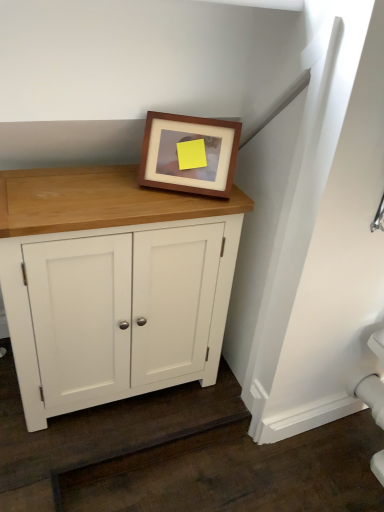
Question: Considering their positions, is brown wooden picture frame at upper center located in front of or behind white wood cupboard at center?

Choices:
 (A) behind
 (B) front

Answer: (A)

Question: Is brown wooden picture frame at upper center wider or thinner than white wood cupboard at center?

Choices:
 (A) wide
 (B) thin

Answer: (B)

Question: In the image, is brown wooden picture frame at upper center on the left side or the right side of white wood cupboard at center?

Choices:
 (A) left
 (B) right

Answer: (B)

Question: Considering the positions of point (67, 236) and point (157, 115), is point (67, 236) closer or farther from the camera than point (157, 115)?

Choices:
 (A) farther
 (B) closer

Answer: (B)

Question: In terms of size, does white wood cupboard at center appear bigger or smaller than brown wooden picture frame at upper center?

Choices:
 (A) big
 (B) small

Answer: (A)

Question: Do you think white wood cupboard at center is within brown wooden picture frame at upper center, or outside of it?

Choices:
 (A) outside
 (B) inside

Answer: (A)

Question: From a real-world perspective, relative to brown wooden picture frame at upper center, is white wood cupboard at center vertically above or below?

Choices:
 (A) below
 (B) above

Answer: (A)